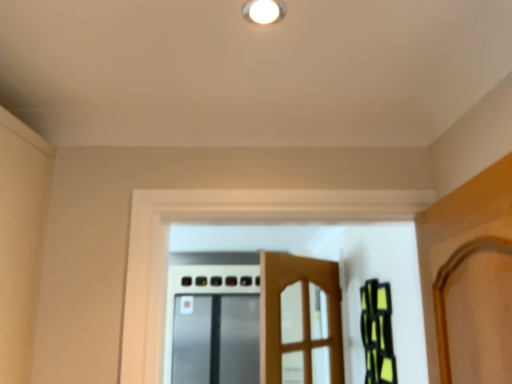
In order to click on satin silver screen door at center in this screenshot , I will do [216, 339].

This screenshot has height=384, width=512. Describe the element at coordinates (264, 11) in the screenshot. I see `white glossy light fixture at upper center` at that location.

At what (x,y) coordinates should I click in order to perform the action: click on satin silver screen door at center. Please return your answer as a coordinate pair (x, y). This screenshot has width=512, height=384. Looking at the image, I should click on (216, 339).

Considering the sizes of satin silver screen door at center and wooden door at center in the image, is satin silver screen door at center wider or thinner than wooden door at center?

Considering their sizes, satin silver screen door at center looks broader than wooden door at center.

Does point (219, 363) come farther from viewer compared to point (279, 381)?

Yes, it is behind point (279, 381).

Which of these two, satin silver screen door at center or wooden door at center, stands taller?

satin silver screen door at center.

From the picture: Which is in front, wooden door at center or white glossy light fixture at upper center?

white glossy light fixture at upper center is closer to the camera.

Is wooden door at center positioned far away from white glossy light fixture at upper center?

Yes, wooden door at center and white glossy light fixture at upper center are located far from each other.

Is wooden door at center positioned beyond the bounds of white glossy light fixture at upper center?

wooden door at center lies outside white glossy light fixture at upper center's area.

From their relative heights in the image, would you say wooden door at center is taller or shorter than white glossy light fixture at upper center?

Clearly, wooden door at center is taller compared to white glossy light fixture at upper center.

From a real-world perspective, is white glossy light fixture at upper center on top of wooden door at center?

Yes, from a real-world perspective, white glossy light fixture at upper center is over wooden door at center

Based on the photo, is white glossy light fixture at upper center facing towards wooden door at center?

No.

From the picture: Is wooden door at center a part of white glossy light fixture at upper center?

Definitely not — wooden door at center is not inside white glossy light fixture at upper center.

Is satin silver screen door at center next to white glossy light fixture at upper center and touching it?

They are not placed beside each other.

Is satin silver screen door at center to the left of white glossy light fixture at upper center from the viewer's perspective?

Indeed, satin silver screen door at center is positioned on the left side of white glossy light fixture at upper center.

The height and width of the screenshot is (384, 512). I want to click on screen door directly beneath the white glossy light fixture at upper center (from a real-world perspective), so click(x=216, y=339).

Can you confirm if satin silver screen door at center is shorter than white glossy light fixture at upper center?

No, satin silver screen door at center is not shorter than white glossy light fixture at upper center.

Considering the relative sizes of wooden door at center and satin silver screen door at center in the image provided, is wooden door at center shorter than satin silver screen door at center?

Yes, wooden door at center is shorter than satin silver screen door at center.

Locate an element on the screen. The height and width of the screenshot is (384, 512). door above the satin silver screen door at center (from a real-world perspective) is located at coordinates (302, 314).

From the picture: Is wooden door at center closer to the viewer compared to satin silver screen door at center?

Yes, the depth of wooden door at center is less than that of satin silver screen door at center.

Which object is positioned more to the left, wooden door at center or satin silver screen door at center?

satin silver screen door at center is more to the left.

Is white glossy light fixture at upper center far away from satin silver screen door at center?

white glossy light fixture at upper center is far away from satin silver screen door at center.

Is white glossy light fixture at upper center looking in the opposite direction of satin silver screen door at center?

That's not correct — white glossy light fixture at upper center is not looking away from satin silver screen door at center.

From the image's perspective, is white glossy light fixture at upper center located beneath satin silver screen door at center?

Incorrect, from the image's perspective, white glossy light fixture at upper center is higher than satin silver screen door at center.

Find the location of `screen door located behind the wooden door at center`. screen door located behind the wooden door at center is located at coordinates (216, 339).

Locate an element on the screen. The image size is (512, 384). door lying on the right of white glossy light fixture at upper center is located at coordinates (302, 314).

When comparing their distances from wooden door at center, does white glossy light fixture at upper center or satin silver screen door at center seem closer?

white glossy light fixture at upper center is closer to wooden door at center.

Looking at the image, which one is located further to satin silver screen door at center, white glossy light fixture at upper center or wooden door at center?

Based on the image, white glossy light fixture at upper center appears to be further to satin silver screen door at center.

Looking at the image, which one is located further to white glossy light fixture at upper center, satin silver screen door at center or wooden door at center?

satin silver screen door at center is further to white glossy light fixture at upper center.

Considering their positions, is satin silver screen door at center positioned further to wooden door at center than white glossy light fixture at upper center?

Among the two, satin silver screen door at center is located further to wooden door at center.

Looking at the image, which one is located closer to satin silver screen door at center, wooden door at center or white glossy light fixture at upper center?

wooden door at center.

When comparing their distances from white glossy light fixture at upper center, does wooden door at center or satin silver screen door at center seem closer?

Based on the image, wooden door at center appears to be nearer to white glossy light fixture at upper center.

Identify the location of door between white glossy light fixture at upper center and satin silver screen door at center from front to back. This screenshot has height=384, width=512. (302, 314).